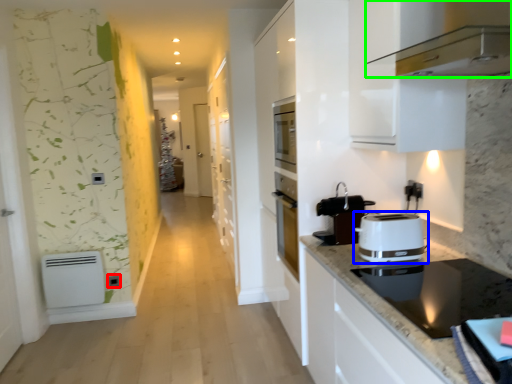
Question: Considering the real-world distances, which object is closest to electric outlet (highlighted by a red box)? toaster (highlighted by a blue box) or home appliance (highlighted by a green box).

Choices:
 (A) toaster
 (B) home appliance

Answer: (A)